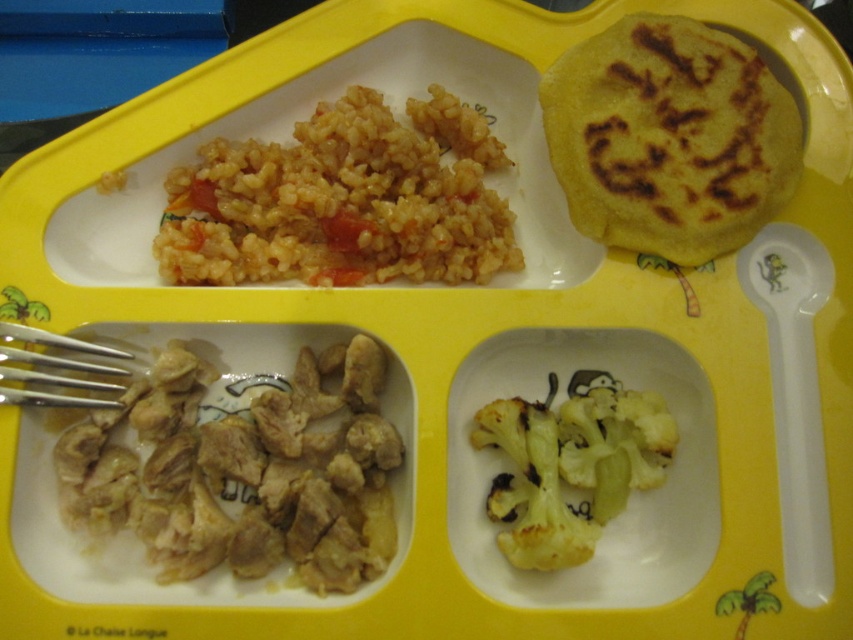
Question: Which point is closer to the camera?

Choices:
 (A) silver metallic fork at lower left
 (B) yellowish matte cauliflower at bottom right
 (C) golden brown rice at upper left
 (D) yellow/green textured broccoli at bottom right

Answer: (A)

Question: Which of the following is the closest to the observer?

Choices:
 (A) yellowish matte cauliflower at bottom right
 (B) yellow/green textured broccoli at bottom right
 (C) golden brown rice at upper left
 (D) silver metallic fork at lower left

Answer: (D)

Question: Which point is farther to the camera?

Choices:
 (A) (546, 525)
 (B) (181, 184)
 (C) (619, 435)

Answer: (B)

Question: Can you confirm if yellowish matte cauliflower at bottom right is positioned below yellow/green textured broccoli at bottom right?

Choices:
 (A) no
 (B) yes

Answer: (B)

Question: Observing the image, what is the correct spatial positioning of yellowish matte cauliflower at bottom right in reference to silver metallic fork at lower left?

Choices:
 (A) below
 (B) above

Answer: (A)

Question: Can you confirm if yellow/green textured broccoli at bottom right is bigger than silver metallic fork at lower left?

Choices:
 (A) yes
 (B) no

Answer: (A)